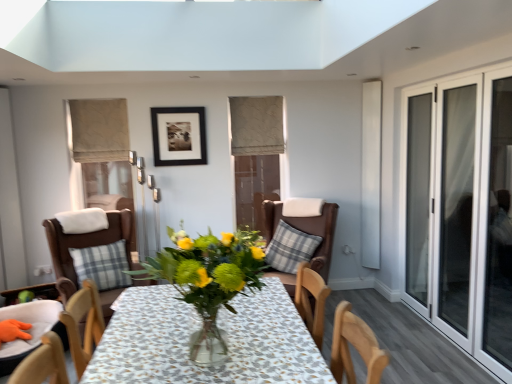
Question: From a real-world perspective, is wooden chair at lower left, which is counted as the 1th chair, starting from the left, physically located above or below transparent glass screen door at right?

Choices:
 (A) above
 (B) below

Answer: (B)

Question: Looking at the image, does wooden chair at lower left, the third chair when ordered from right to left, seem bigger or smaller compared to transparent glass screen door at right?

Choices:
 (A) big
 (B) small

Answer: (A)

Question: Estimate the real-world distances between objects in this image. Which object is farther from the plaid fabric pillow at left, the 1th pillow positioned from the left?

Choices:
 (A) beige fabric curtain at upper left, the second curtain positioned from the right
 (B) wooden chair at lower left, the third chair when ordered from right to left
 (C) brown leather chair at left, which is counted as the second chair, starting from the left
 (D) brown leather chair at center, which is counted as the third chair, starting from the left
 (E) beige fabric curtain at upper center, which appears as the 2th curtain when viewed from the left

Answer: (E)

Question: Which of these objects is positioned farthest from the brown leather chair at left, which is counted as the second chair, starting from the left?

Choices:
 (A) beige fabric curtain at upper center, the first curtain in the right-to-left sequence
 (B) wooden chair at lower left, which is counted as the 1th chair, starting from the left
 (C) plaid fabric pillow at center, which is the second pillow from left to right
 (D) translucent glass vase at center
 (E) transparent glass door at right

Answer: (E)